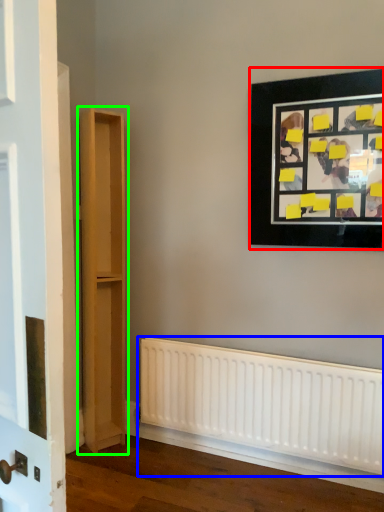
Question: Estimate the real-world distances between objects in this image. Which object is closer to picture frame (highlighted by a red box), radiator (highlighted by a blue box) or bookshelf (highlighted by a green box)?

Choices:
 (A) radiator
 (B) bookshelf

Answer: (A)